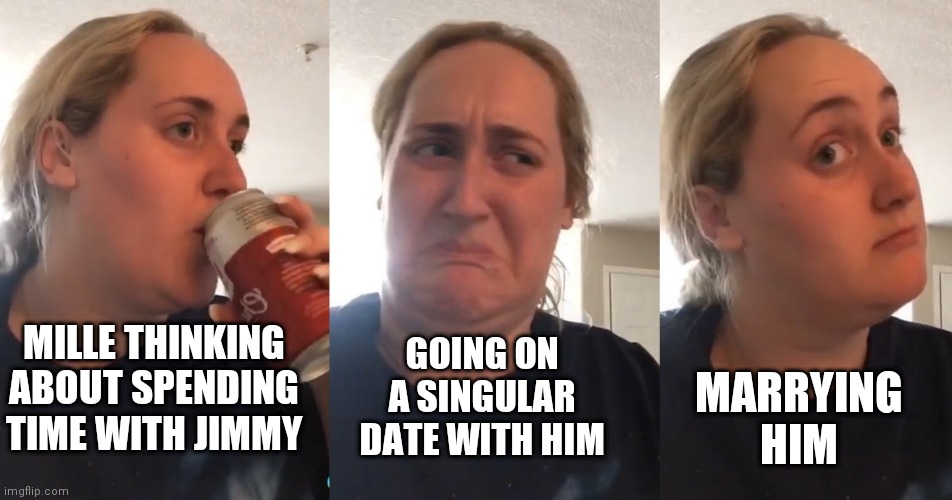
Find the location of a particular element. This screenshot has width=952, height=500. door is located at coordinates (639, 311), (946, 303).